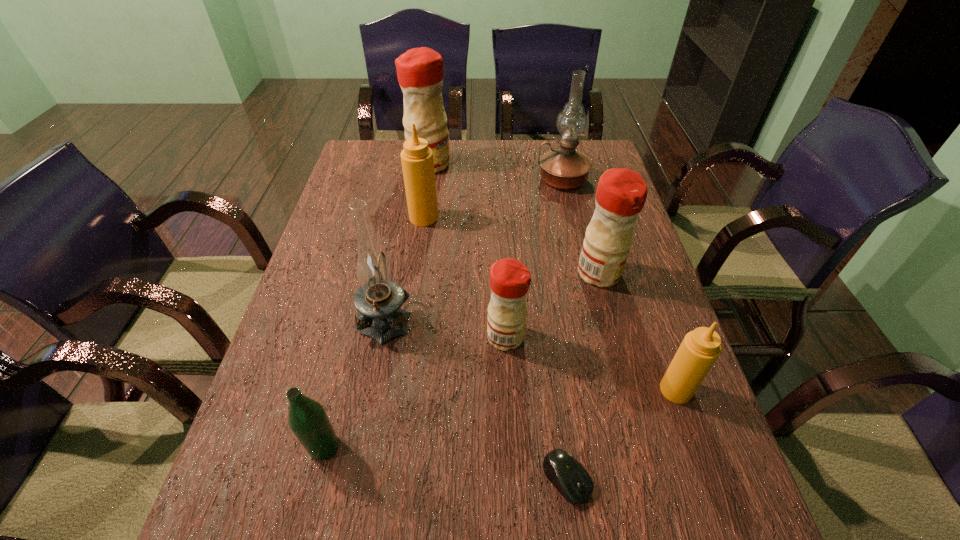
Where is `vacant space located on the back of the smaller tan condiment`? This screenshot has height=540, width=960. vacant space located on the back of the smaller tan condiment is located at coordinates (632, 260).

The image size is (960, 540). Find the location of `vacant space positioned 0.260m on the left of the third condiment from left to right`. vacant space positioned 0.260m on the left of the third condiment from left to right is located at coordinates (374, 337).

At what (x,y) coordinates should I click in order to perform the action: click on vacant area located 0.390m on the back of the green bottle. Please return your answer as a coordinate pair (x, y). Looking at the image, I should click on (x=364, y=285).

The height and width of the screenshot is (540, 960). I want to click on free point located 0.140m on the right of the shortest object, so click(667, 479).

At what (x,y) coordinates should I click in order to perform the action: click on condiment that is at the far edge. Please return your answer as a coordinate pair (x, y). The height and width of the screenshot is (540, 960). Looking at the image, I should click on (419, 70).

The width and height of the screenshot is (960, 540). Find the location of `oil lamp present at the far edge`. oil lamp present at the far edge is located at coordinates (565, 168).

In order to click on object at the left edge in this screenshot , I will do `click(307, 418)`.

What are the coordinates of `oil lamp at the right edge` in the screenshot? It's located at (565, 168).

This screenshot has width=960, height=540. Find the location of `object that is at the far right corner`. object that is at the far right corner is located at coordinates (565, 168).

Identify the location of vacant area at the far edge. The image size is (960, 540). (456, 151).